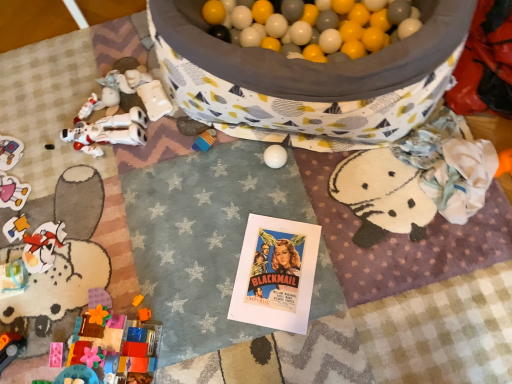
Where is `free space behind orange plastic car at lower left, the 2th toy viewed from the front`? This screenshot has height=384, width=512. free space behind orange plastic car at lower left, the 2th toy viewed from the front is located at coordinates (29, 300).